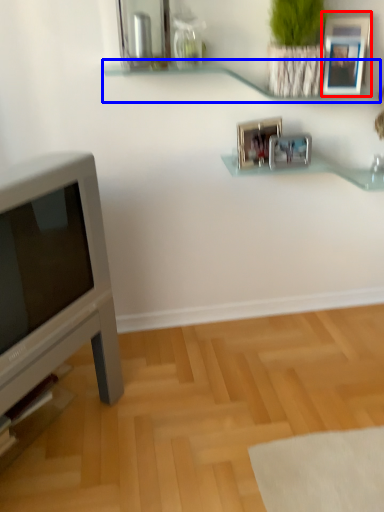
Question: Which object appears closest to the camera in this image, picture frame (highlighted by a red box) or shelf (highlighted by a blue box)?

Choices:
 (A) picture frame
 (B) shelf

Answer: (B)